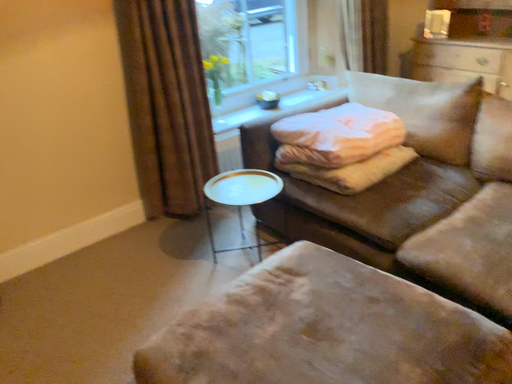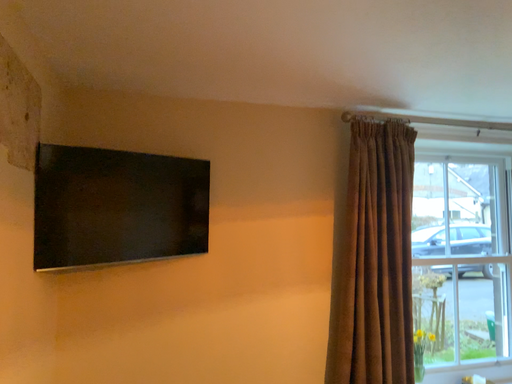
Question: Which way did the camera rotate in the video?

Choices:
 (A) rotated upward
 (B) rotated downward

Answer: (A)